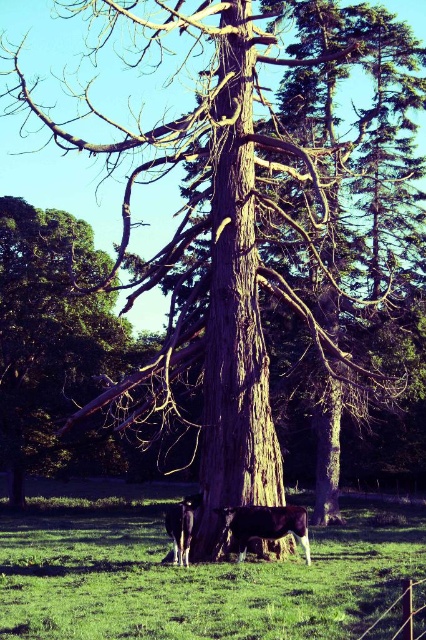
You are standing at the base of the large tree in the center of the rural scene. You notice two points marked in the image. If you were to walk towards point 1 at coordinates point (333, 632) and point 2 at coordinates point (31, 312), which point would you reach first?

You would reach point 1 at coordinates point (333, 632) first because it is in front of point 2 at coordinates point (31, 312).